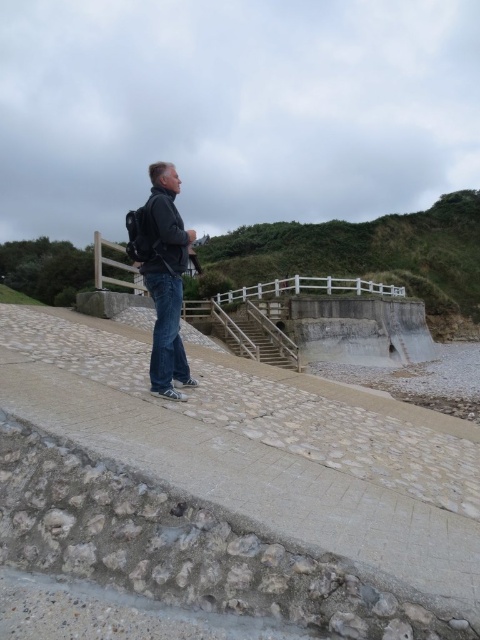
You are a hiker who wants to descend to the beach. You see the smooth concrete at center and the smooth concrete stairs at center. Which one should you use to go down?

The smooth concrete stairs at center should be used to go down because the smooth concrete at center is located below them, indicating the stairs lead downward.

You are a delivery person who needs to place a matte black backpack at center on the smooth concrete at center. Can you fit the backpack on the concrete without it hanging over the edges?

The smooth concrete at center has a larger width than the matte black backpack at center, so yes, the backpack can be placed on the smooth concrete at center without overhanging.

You are standing on the pathway and want to reach the beach below. There is a point at coordinates (233, 488) that has smooth concrete at center. Which direction should you walk to get to the smooth concrete at center from your current position on the pathway?

You should walk towards the center to reach the smooth concrete at center located at point (233, 488).